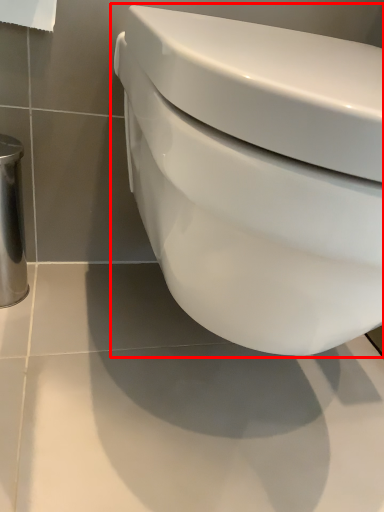
Question: From the image's perspective, where is toilet (annotated by the red box) located in relation to toilet paper in the image?

Choices:
 (A) below
 (B) above

Answer: (A)